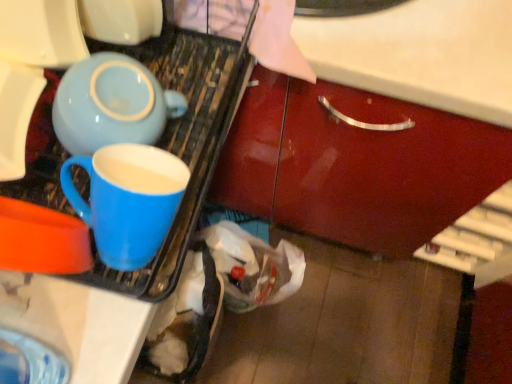
Where is `matte ceramic mug at left`? The height and width of the screenshot is (384, 512). matte ceramic mug at left is located at coordinates (128, 200).

What is the approximate height of matte ceramic mug at left?

4.33 inches.

This screenshot has width=512, height=384. What do you see at coordinates (128, 200) in the screenshot? I see `matte ceramic mug at left` at bounding box center [128, 200].

The height and width of the screenshot is (384, 512). Describe the element at coordinates (181, 149) in the screenshot. I see `matte blue mug at left` at that location.

At what (x,y) coordinates should I click in order to perform the action: click on matte blue mug at left. Please return your answer as a coordinate pair (x, y). This screenshot has height=384, width=512. Looking at the image, I should click on (181, 149).

Identify the location of matte ceramic mug at left. (128, 200).

Considering the relative positions of matte ceramic mug at left and matte blue mug at left in the image provided, is matte ceramic mug at left to the right of matte blue mug at left from the viewer's perspective?

Yes.

Considering their positions, is matte ceramic mug at left located in front of or behind matte blue mug at left?

matte ceramic mug at left is in front of matte blue mug at left.

Between point (138, 237) and point (104, 287), which one is positioned in front?

The point (138, 237) is closer.

From the image's perspective, is matte ceramic mug at left located beneath matte blue mug at left?

Yes.

From a real-world perspective, which object stands above the other?

matte ceramic mug at left.

Between matte ceramic mug at left and matte blue mug at left, which one has smaller width?

matte ceramic mug at left.

Who is taller, matte ceramic mug at left or matte blue mug at left?

Standing taller between the two is matte blue mug at left.

Is matte ceramic mug at left smaller than matte blue mug at left?

Yes, matte ceramic mug at left is smaller than matte blue mug at left.

Consider the image. Would you say matte ceramic mug at left contains matte blue mug at left?

No, matte blue mug at left is not a part of matte ceramic mug at left.

Is matte ceramic mug at left in contact with matte blue mug at left?

Yes, matte ceramic mug at left is touching matte blue mug at left.

Is matte ceramic mug at left turned away from matte blue mug at left?

Yes, matte ceramic mug at left's orientation is away from matte blue mug at left.

What's the angular difference between matte ceramic mug at left and matte blue mug at left's facing directions?

There is a 0.000511-degree angle between the facing directions of matte ceramic mug at left and matte blue mug at left.

This screenshot has height=384, width=512. Find the location of `coffee cup below the matte blue mug at left (from the image's perspective)`. coffee cup below the matte blue mug at left (from the image's perspective) is located at coordinates (128, 200).

Which object is positioned more to the left, matte blue mug at left or matte ceramic mug at left?

Positioned to the left is matte blue mug at left.

Is matte blue mug at left behind matte ceramic mug at left?

Yes, matte blue mug at left is further from the viewer.

Is point (146, 294) closer or farther from the camera than point (111, 163)?

Clearly, point (146, 294) is more distant from the camera than point (111, 163).

From the image's perspective, between matte blue mug at left and matte ceramic mug at left, who is located below?

matte ceramic mug at left.

From a real-world perspective, which object rests below the other?

Result: From a 3D spatial view, matte blue mug at left is below.

Which of these two, matte blue mug at left or matte ceramic mug at left, is thinner?

Thinner between the two is matte ceramic mug at left.

Which of these two, matte blue mug at left or matte ceramic mug at left, stands taller?

matte blue mug at left.

Between matte blue mug at left and matte ceramic mug at left, which one has smaller size?

matte ceramic mug at left.

Is matte blue mug at left spatially inside matte ceramic mug at left, or outside of it?

matte blue mug at left is spatially situated outside matte ceramic mug at left.

Is matte blue mug at left with matte ceramic mug at left?

Yes, matte blue mug at left is beside matte ceramic mug at left.

Does matte blue mug at left turn towards matte ceramic mug at left?

Yes, matte blue mug at left faces towards matte ceramic mug at left.

Locate an element on the screen. coffee cup in front of the matte blue mug at left is located at coordinates (128, 200).

Locate an element on the screen. This screenshot has height=384, width=512. appliance on the left of matte ceramic mug at left is located at coordinates (181, 149).

I want to click on coffee cup below the matte blue mug at left (from the image's perspective), so coord(128,200).